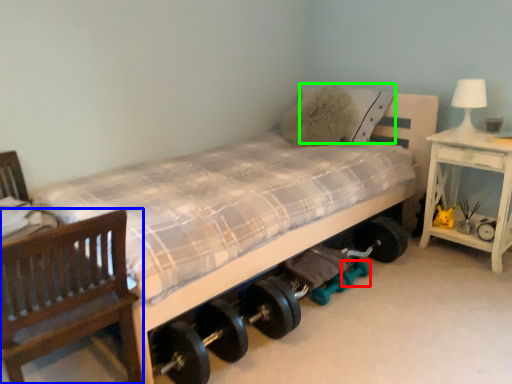
Question: Which object is the farthest from dumbbell (highlighted by a red box)? Choose among these: chair (highlighted by a blue box) or pillow (highlighted by a green box).

Choices:
 (A) chair
 (B) pillow

Answer: (A)